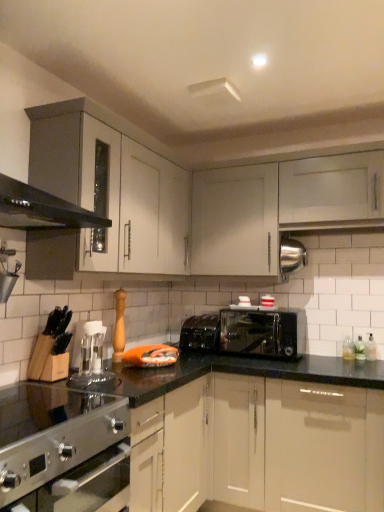
Question: In terms of size, does white glossy cabinet at upper right, which ranks as the second cabinetry in left-to-right order, appear bigger or smaller than black plastic toaster at center?

Choices:
 (A) small
 (B) big

Answer: (B)

Question: In the image, is white glossy cabinet at upper right, which ranks as the second cabinetry in left-to-right order, positioned in front of or behind black plastic toaster at center?

Choices:
 (A) behind
 (B) front

Answer: (B)

Question: Which is farther from the black metallic toaster at center?

Choices:
 (A) clear glass bottle at lower right
 (B) satin silver gas stove at lower left
 (C) white glossy cabinet at upper right, arranged as the first cabinetry when viewed from the right
 (D) satin silver oven at lower left
 (E) black plastic toaster at center

Answer: (D)

Question: Which of these objects is positioned closest to the transparent plastic coffee machine at center?

Choices:
 (A) satin silver gas stove at lower left
 (B) black metallic toaster at center
 (C) black plastic toaster at center
 (D) satin silver oven at lower left
 (E) white glossy cabinet at upper right, which ranks as the second cabinetry in left-to-right order

Answer: (A)